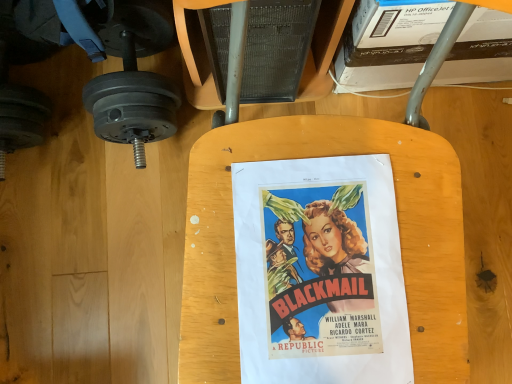
Measure the distance between point (355, 351) and camera.

A distance of 20.51 inches exists between point (355, 351) and camera.

At what (x,y) coordinates should I click in order to perform the action: click on vibrant paper poster at center. Please return your answer as a coordinate pair (x, y). The height and width of the screenshot is (384, 512). Looking at the image, I should click on (320, 272).

The height and width of the screenshot is (384, 512). What do you see at coordinates (320, 272) in the screenshot?
I see `vibrant paper poster at center` at bounding box center [320, 272].

Measure the distance between vibrant paper poster at center and camera.

vibrant paper poster at center and camera are 20.38 inches apart.

Image resolution: width=512 pixels, height=384 pixels. In order to click on matte black dumbbell at left in this screenshot , I will do `click(135, 79)`.

This screenshot has width=512, height=384. What do you see at coordinates (135, 79) in the screenshot?
I see `matte black dumbbell at left` at bounding box center [135, 79].

Where is `vibrant paper poster at center`? Image resolution: width=512 pixels, height=384 pixels. vibrant paper poster at center is located at coordinates (320, 272).

Does matte black dumbbell at left appear on the left side of vibrant paper poster at center?

Indeed, matte black dumbbell at left is positioned on the left side of vibrant paper poster at center.

Between matte black dumbbell at left and vibrant paper poster at center, which one is positioned behind?

matte black dumbbell at left.

Considering the points (149, 103) and (243, 172), which point is in front, point (149, 103) or point (243, 172)?

The point (243, 172) is closer.

From the image's perspective, which object appears higher, matte black dumbbell at left or vibrant paper poster at center?

matte black dumbbell at left is shown above in the image.

From a real-world perspective, does matte black dumbbell at left sit lower than vibrant paper poster at center?

Yes, from a real-world perspective, matte black dumbbell at left is beneath vibrant paper poster at center.

Between matte black dumbbell at left and vibrant paper poster at center, which one has smaller width?

vibrant paper poster at center is thinner.

Which of these two, matte black dumbbell at left or vibrant paper poster at center, stands taller?

Standing taller between the two is matte black dumbbell at left.

Considering the relative sizes of matte black dumbbell at left and vibrant paper poster at center in the image provided, is matte black dumbbell at left smaller than vibrant paper poster at center?

No, matte black dumbbell at left is not smaller than vibrant paper poster at center.

Is matte black dumbbell at left positioned beyond the bounds of vibrant paper poster at center?

Yes, matte black dumbbell at left is not within vibrant paper poster at center.

Is matte black dumbbell at left not close to vibrant paper poster at center?

No, there isn't a large distance between matte black dumbbell at left and vibrant paper poster at center.

Is matte black dumbbell at left facing towards vibrant paper poster at center?

No, matte black dumbbell at left does not turn towards vibrant paper poster at center.

In the image, there is a vibrant paper poster at center. Where is `dumbbell below it (from a real-world perspective)`? Image resolution: width=512 pixels, height=384 pixels. dumbbell below it (from a real-world perspective) is located at coordinates (135, 79).

Which object is positioned more to the right, vibrant paper poster at center or matte black dumbbell at left?

Positioned to the right is vibrant paper poster at center.

Is vibrant paper poster at center positioned in front of matte black dumbbell at left?

Yes, it is in front of matte black dumbbell at left.

Is point (279, 185) positioned after point (122, 131)?

No, (279, 185) is closer to viewer.

From the image's perspective, is vibrant paper poster at center located above or below matte black dumbbell at left?

From the image's perspective, vibrant paper poster at center appears below matte black dumbbell at left.

From a real-world perspective, is vibrant paper poster at center above or below matte black dumbbell at left?

Clearly, from a real-world perspective, vibrant paper poster at center is above matte black dumbbell at left.

Considering the relative sizes of vibrant paper poster at center and matte black dumbbell at left in the image provided, is vibrant paper poster at center thinner than matte black dumbbell at left?

Yes, vibrant paper poster at center is thinner than matte black dumbbell at left.

Does vibrant paper poster at center have a greater height compared to matte black dumbbell at left?

No.

Which of these two, vibrant paper poster at center or matte black dumbbell at left, is smaller?

vibrant paper poster at center.

Is vibrant paper poster at center spatially inside matte black dumbbell at left, or outside of it?

vibrant paper poster at center is not inside matte black dumbbell at left, it's outside.

Is vibrant paper poster at center directly adjacent to matte black dumbbell at left?

No, vibrant paper poster at center is not with matte black dumbbell at left.

Is vibrant paper poster at center oriented towards matte black dumbbell at left?

No, vibrant paper poster at center is not turned towards matte black dumbbell at left.

Find the location of `dumbbell that appears behind the vibrant paper poster at center`. dumbbell that appears behind the vibrant paper poster at center is located at coordinates (135, 79).

Identify the location of poster below the matte black dumbbell at left (from the image's perspective). The image size is (512, 384). (320, 272).

I want to click on dumbbell that is above the vibrant paper poster at center (from the image's perspective), so click(135, 79).